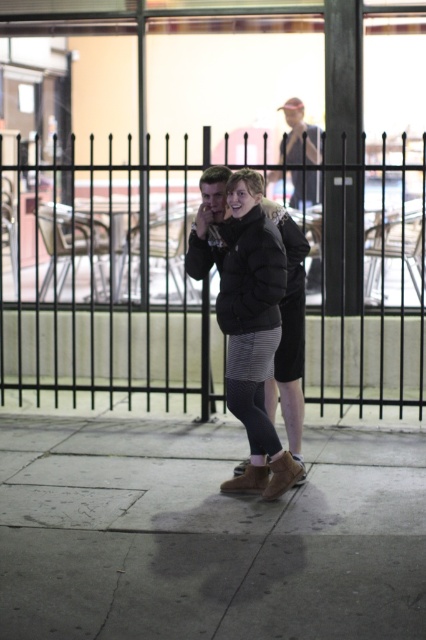
From the picture: Does brown leather boots at center appear on the left side of black puffer jacket at center?

Incorrect, brown leather boots at center is not on the left side of black puffer jacket at center.

Who is more distant from viewer, (305, 561) or (241, 390)?

Point (241, 390)

This screenshot has width=426, height=640. Find the location of `brown leather boots at center`. brown leather boots at center is located at coordinates (206, 536).

Which of these two, black puffer jacket at center or light brown leather jacket at upper center, stands shorter?

light brown leather jacket at upper center

Does black puffer jacket at center appear under light brown leather jacket at upper center?

Correct, black puffer jacket at center is located below light brown leather jacket at upper center.

Locate an element on the screen. black puffer jacket at center is located at coordinates (245, 314).

Is point (31, 193) behind point (311, 144)?

Yes, it is.

How far apart are black metal fence at center and light brown leather jacket at upper center?

A distance of 2.05 meters exists between black metal fence at center and light brown leather jacket at upper center.

Describe the element at coordinates (103, 280) in the screenshot. The height and width of the screenshot is (640, 426). I see `black metal fence at center` at that location.

This screenshot has height=640, width=426. Identify the location of black metal fence at center. (103, 280).